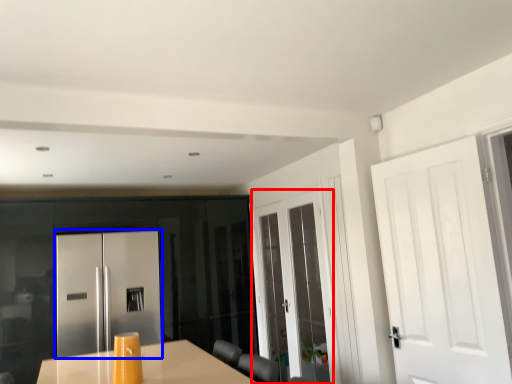
Question: Among these objects, which one is farthest to the camera, door (highlighted by a red box) or door (highlighted by a blue box)?

Choices:
 (A) door
 (B) door

Answer: (B)